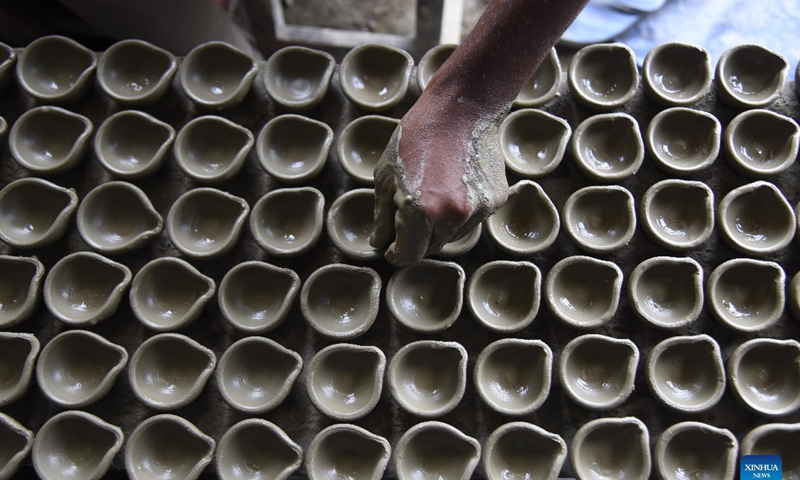
Locate an element on the screen. Image resolution: width=800 pixels, height=480 pixels. cup is located at coordinates (758, 148).